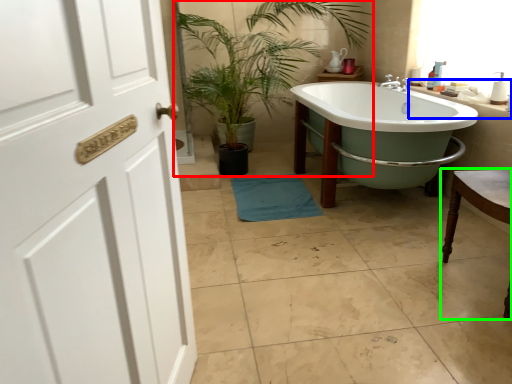
Question: Based on their relative distances, which object is farther from houseplant (highlighted by a red box)? Choose from counter top (highlighted by a blue box) and chair (highlighted by a green box).

Choices:
 (A) counter top
 (B) chair

Answer: (B)